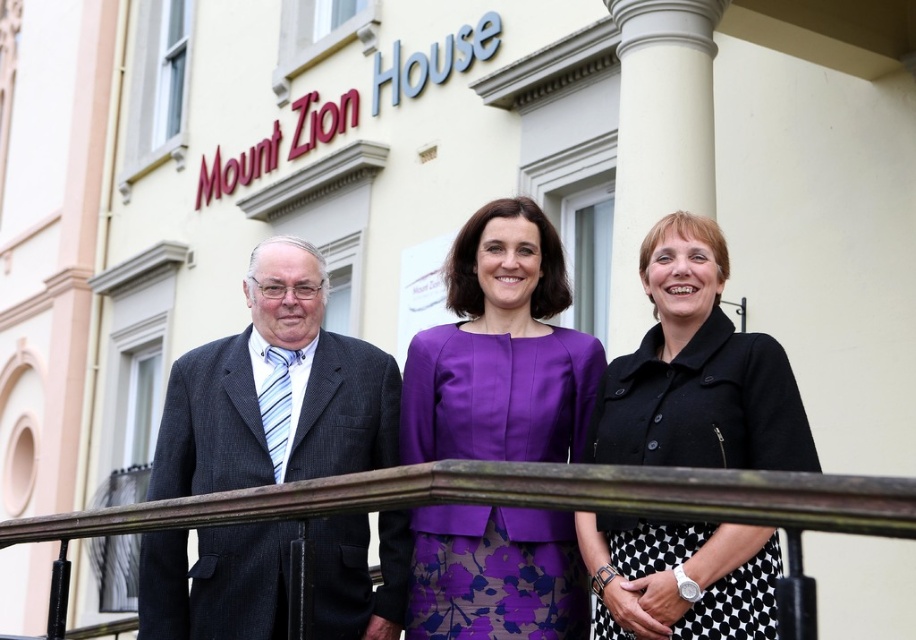
Question: Which of the following is the farthest from the observer?

Choices:
 (A) matte black suit at center
 (B) black matte jacket at center

Answer: (B)

Question: Which object appears farthest from the camera in this image?

Choices:
 (A) white smooth column at center
 (B) purple satin dress at center
 (C) brown wooden rail at center

Answer: (A)

Question: Which point is farther to the camera?

Choices:
 (A) dark gray pinstripe suit at left
 (B) matte black suit at center

Answer: (B)

Question: Observing the image, what is the correct spatial positioning of matte black suit at center in reference to dark gray pinstripe suit at left?

Choices:
 (A) above
 (B) below

Answer: (A)

Question: Is purple satin dress at center to the left of brown wooden rail at center from the viewer's perspective?

Choices:
 (A) yes
 (B) no

Answer: (B)

Question: Considering the relative positions of matte black suit at center and brown wooden rail at center in the image provided, where is matte black suit at center located with respect to brown wooden rail at center?

Choices:
 (A) left
 (B) right

Answer: (A)